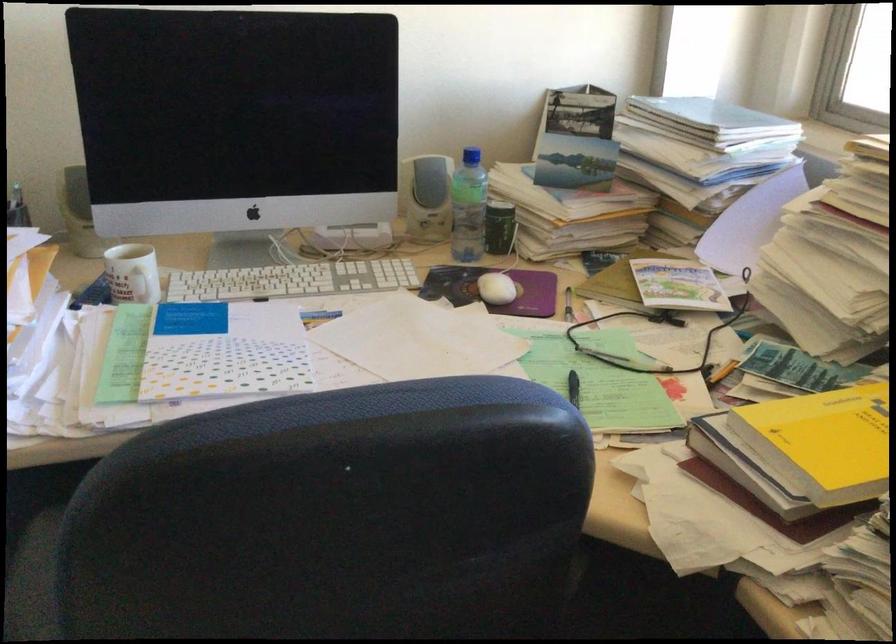
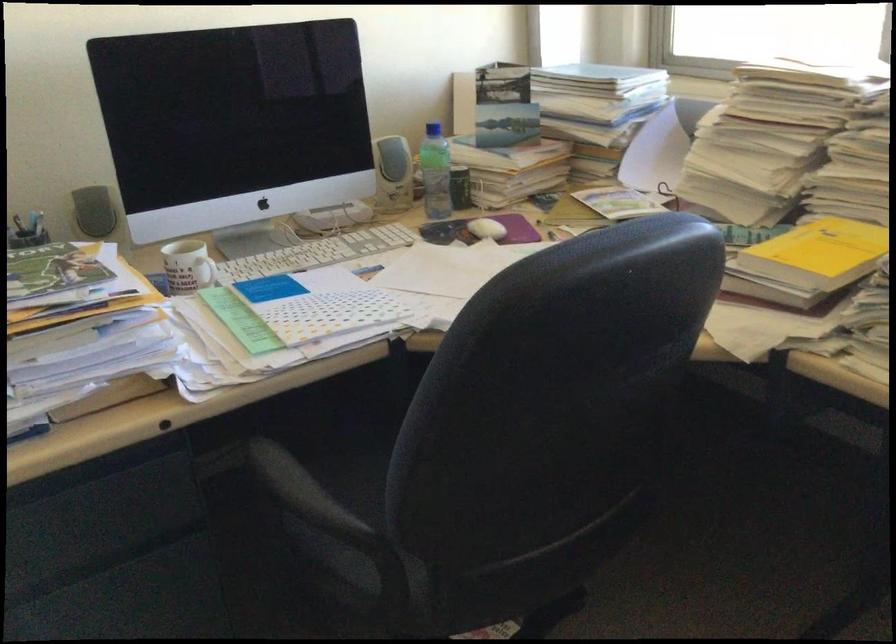
Find the pixel in the second image that matches (x=76, y=196) in the first image.

(93, 211)